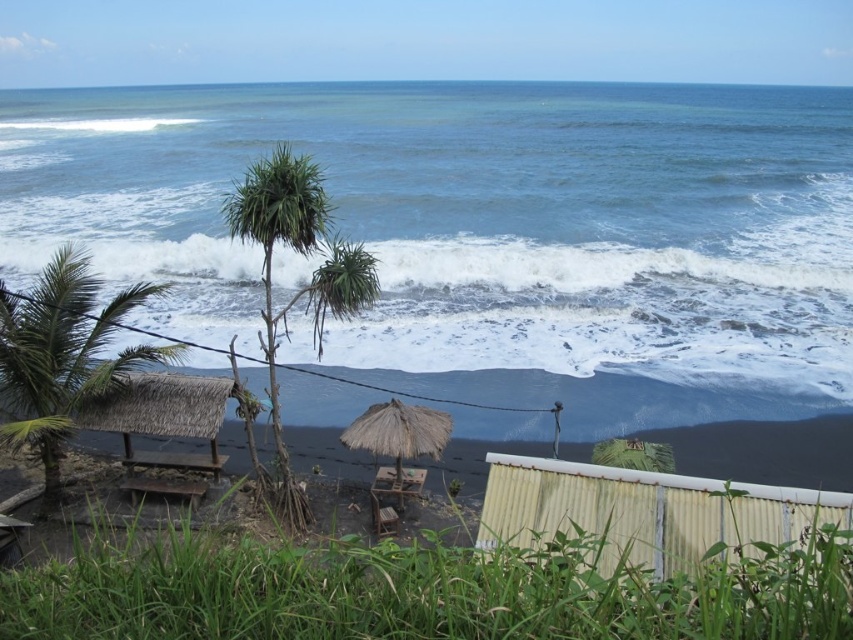
You are standing on the beach and want to walk from the green leafy palm tree at lower left to the yellow corrugated metal hut at lower right. Which direction should you head?

You should head to the right because the yellow corrugated metal hut at lower right is to the right of the green leafy palm tree at lower left.

You are a beachgoer planning to set up a sunshade. You see a white frothy wave at center and a thatched straw umbrella at center. Which object is taller?

The white frothy wave at center is taller than the thatched straw umbrella at center.